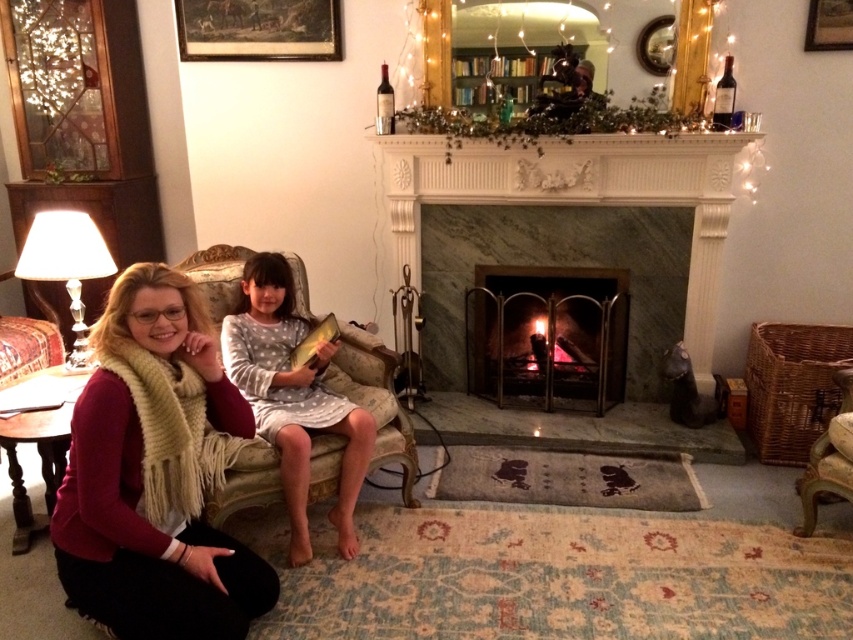
Question: Which point appears closest to the camera in this image?

Choices:
 (A) (109, 365)
 (B) (409, 177)
 (C) (830, 12)

Answer: (A)

Question: Which point is farther from the camera taking this photo?

Choices:
 (A) (242, 378)
 (B) (253, 38)
 (C) (497, 288)

Answer: (C)

Question: Is knitted beige scarf at lower left positioned before matte metal fireplace at center?

Choices:
 (A) no
 (B) yes

Answer: (B)

Question: Among these points, which one is nearest to the camera?

Choices:
 (A) (254, 33)
 (B) (252, 276)
 (C) (590, 342)
 (D) (842, 428)

Answer: (D)

Question: From the image, what is the correct spatial relationship of marble fireplace at center in relation to wooden framed painting at upper left?

Choices:
 (A) below
 (B) above

Answer: (A)

Question: Does matte metal fireplace at center appear on the left side of wooden armchair at lower right?

Choices:
 (A) no
 (B) yes

Answer: (B)